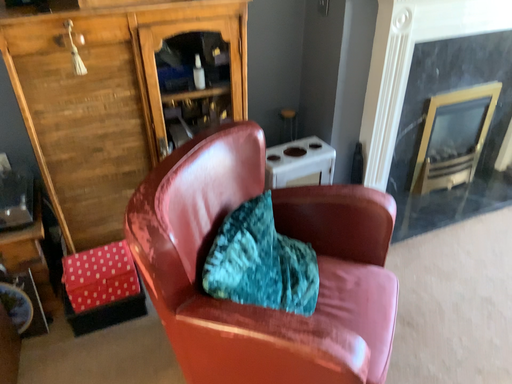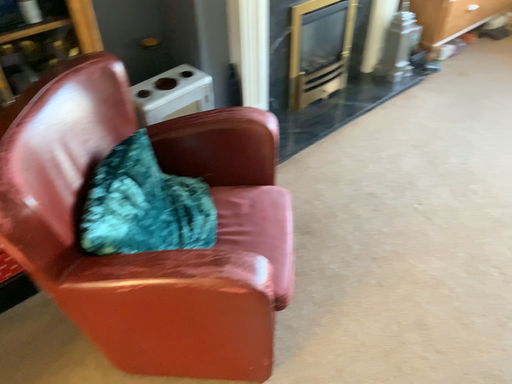
Question: Which way did the camera rotate in the video?

Choices:
 (A) rotated left
 (B) rotated right

Answer: (B)